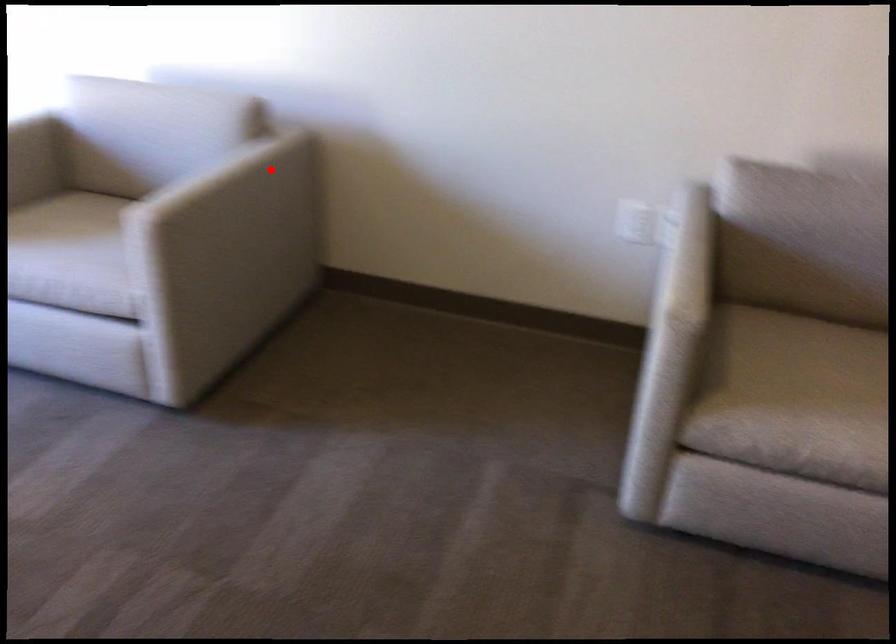
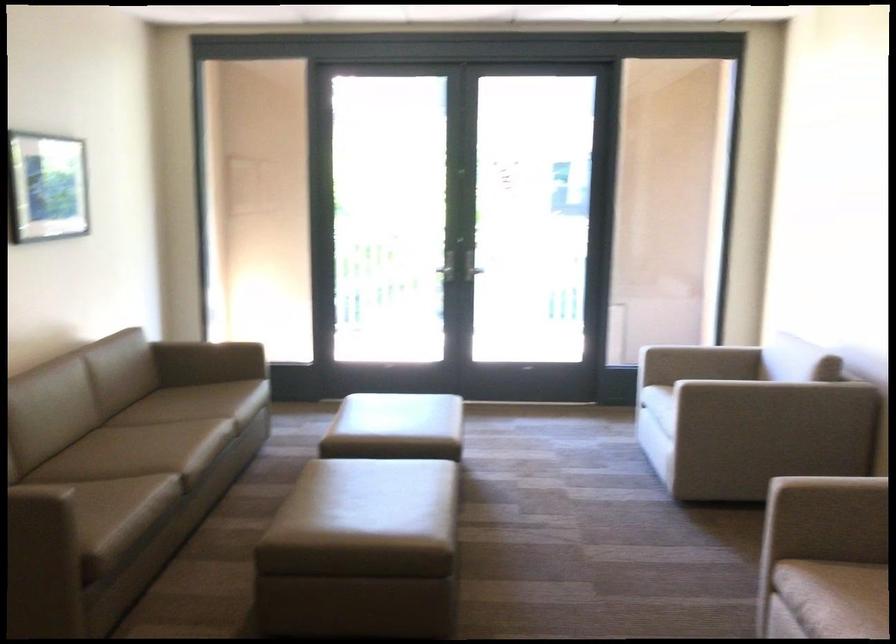
Question: I am providing you with two images of the same scene from different viewpoints. Given a red point in image1, look at the same physical point in image2. Is it:

Choices:
 (A) Closer to the viewpoint
 (B) Farther from the viewpoint

Answer: (B)